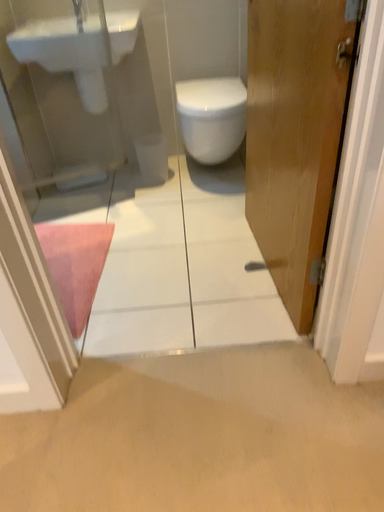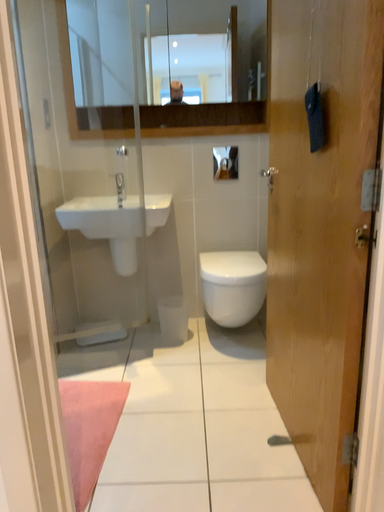
Question: How did the camera likely rotate when shooting the video?

Choices:
 (A) rotated downward
 (B) rotated upward

Answer: (B)